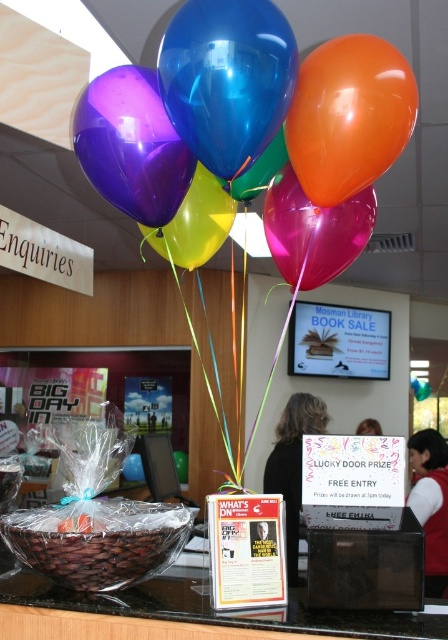
Does shiny blue balloon at center have a larger size compared to translucent pink balloon at center?

Actually, shiny blue balloon at center might be smaller than translucent pink balloon at center.

Is shiny blue balloon at center above translucent pink balloon at center?

Yes, shiny blue balloon at center is above translucent pink balloon at center.

Locate an element on the screen. shiny blue balloon at center is located at coordinates (227, 80).

Identify the location of shiny blue balloon at center. This screenshot has width=448, height=640. (227, 80).

Can you confirm if translucent plastic basket at lower left is positioned above translucent pink balloon at center?

No, translucent plastic basket at lower left is not above translucent pink balloon at center.

Can you confirm if translucent plastic basket at lower left is wider than translucent pink balloon at center?

Yes, translucent plastic basket at lower left is wider than translucent pink balloon at center.

Identify the location of translucent plastic basket at lower left. Image resolution: width=448 pixels, height=640 pixels. (207, 605).

Can you confirm if shiny blue balloon at center is thinner than glossy latex balloons at upper center?

Indeed, shiny blue balloon at center has a lesser width compared to glossy latex balloons at upper center.

Who is more distant from viewer, [255,68] or [121,0]?

Point [121,0]

At what (x,y) coordinates should I click in order to perform the action: click on shiny blue balloon at center. Please return your answer as a coordinate pair (x, y). Image resolution: width=448 pixels, height=640 pixels. Looking at the image, I should click on (x=227, y=80).